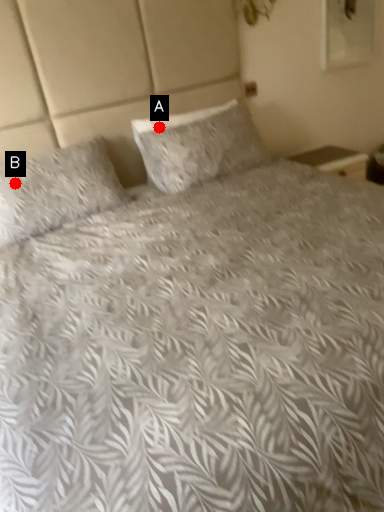
Question: Two points are circled on the image, labeled by A and B beside each circle. Which point is farther to the camera?

Choices:
 (A) A is further
 (B) B is further

Answer: (A)